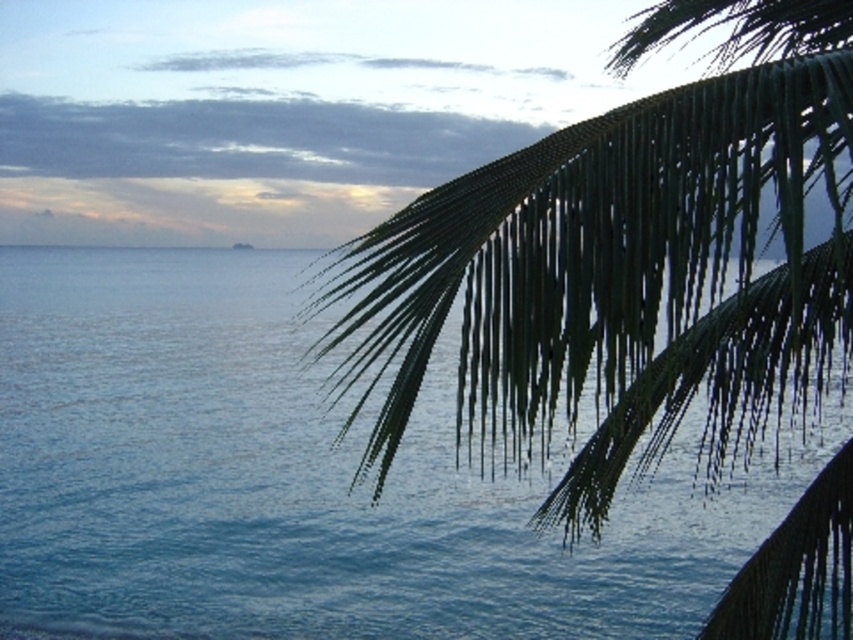
Does blue water at center have a lesser width compared to green leafy palm at upper right?

Incorrect, blue water at center's width is not less than green leafy palm at upper right's.

From the picture: Can you confirm if blue water at center is shorter than green leafy palm at upper right?

No, blue water at center is not shorter than green leafy palm at upper right.

The height and width of the screenshot is (640, 853). In order to click on blue water at center in this screenshot , I will do `click(300, 481)`.

Identify the location of blue water at center. (300, 481).